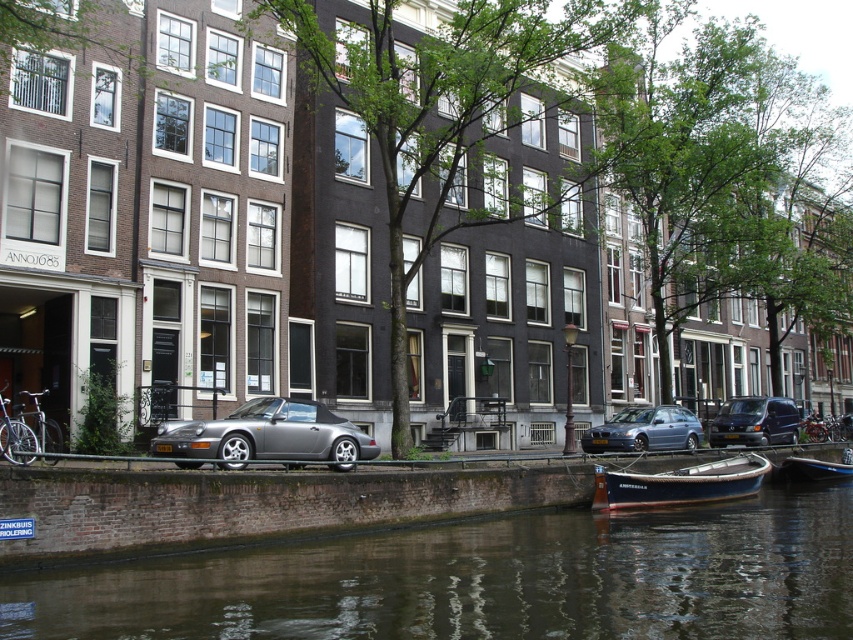
Question: In this image, where is dark brown water at lower center located relative to satin silver convertible at center?

Choices:
 (A) below
 (B) above

Answer: (A)

Question: Considering the real-world distances, which object is farthest from the satin silver convertible at center?

Choices:
 (A) satin silver car at center
 (B) dark brown water at lower center
 (C) wooden boat at lower center

Answer: (A)

Question: Considering the real-world distances, which object is farthest from the satin silver convertible at center?

Choices:
 (A) dark brown water at lower center
 (B) satin silver car at center
 (C) wooden boat at lower right
 (D) wooden boat at lower center

Answer: (C)

Question: From the image, what is the correct spatial relationship of dark brown water at lower center in relation to satin silver convertible at center?

Choices:
 (A) right
 (B) left

Answer: (A)

Question: Does dark brown water at lower center appear over wooden boat at lower center?

Choices:
 (A) no
 (B) yes

Answer: (B)

Question: Which object is the closest to the wooden boat at lower right?

Choices:
 (A) metallic silver van at right
 (B) wooden boat at lower center
 (C) satin silver convertible at center

Answer: (A)